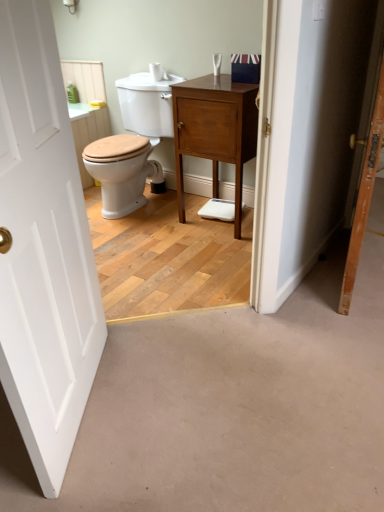
Question: Is wooden door at right, acting as the 1th door starting from the right, closer to the viewer compared to matte wood nightstand at center?

Choices:
 (A) yes
 (B) no

Answer: (A)

Question: Can you confirm if wooden door at right, the second door in the left-to-right sequence, is positioned to the left of matte wood nightstand at center?

Choices:
 (A) no
 (B) yes

Answer: (A)

Question: From a real-world perspective, is wooden door at right, the second door in the left-to-right sequence, physically above matte wood nightstand at center?

Choices:
 (A) yes
 (B) no

Answer: (A)

Question: Is wooden door at right, the second door in the left-to-right sequence, bigger than matte wood nightstand at center?

Choices:
 (A) yes
 (B) no

Answer: (B)

Question: Can you confirm if wooden door at right, the second door in the left-to-right sequence, is wider than matte wood nightstand at center?

Choices:
 (A) no
 (B) yes

Answer: (A)

Question: Can you confirm if wooden door at right, acting as the 1th door starting from the right, is thinner than matte wood nightstand at center?

Choices:
 (A) yes
 (B) no

Answer: (A)

Question: Is wooden door at right, the second door in the left-to-right sequence, further to the viewer compared to white wooden door at left, which is counted as the second door, starting from the right?

Choices:
 (A) no
 (B) yes

Answer: (B)

Question: From the image's perspective, is wooden door at right, the second door in the left-to-right sequence, beneath white wooden door at left, marked as the 1th door in a left-to-right arrangement?

Choices:
 (A) yes
 (B) no

Answer: (B)

Question: From the image's perspective, is wooden door at right, the second door in the left-to-right sequence, on white wooden door at left, which is counted as the second door, starting from the right?

Choices:
 (A) yes
 (B) no

Answer: (A)

Question: Does wooden door at right, acting as the 1th door starting from the right, have a greater height compared to white wooden door at left, marked as the 1th door in a left-to-right arrangement?

Choices:
 (A) no
 (B) yes

Answer: (A)

Question: Is wooden door at right, the second door in the left-to-right sequence, to the left of white wooden door at left, which is counted as the second door, starting from the right, from the viewer's perspective?

Choices:
 (A) yes
 (B) no

Answer: (B)

Question: Is wooden door at right, acting as the 1th door starting from the right, positioned beyond the bounds of white wooden door at left, marked as the 1th door in a left-to-right arrangement?

Choices:
 (A) no
 (B) yes

Answer: (B)

Question: Would you say matte wood nightstand at center is part of white wooden door at left, which is counted as the second door, starting from the right,'s contents?

Choices:
 (A) no
 (B) yes

Answer: (A)